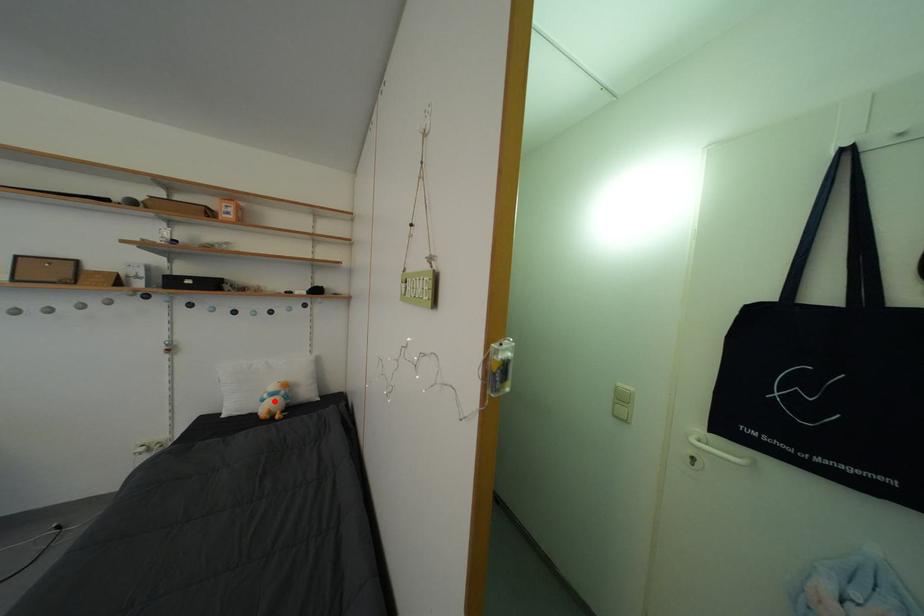
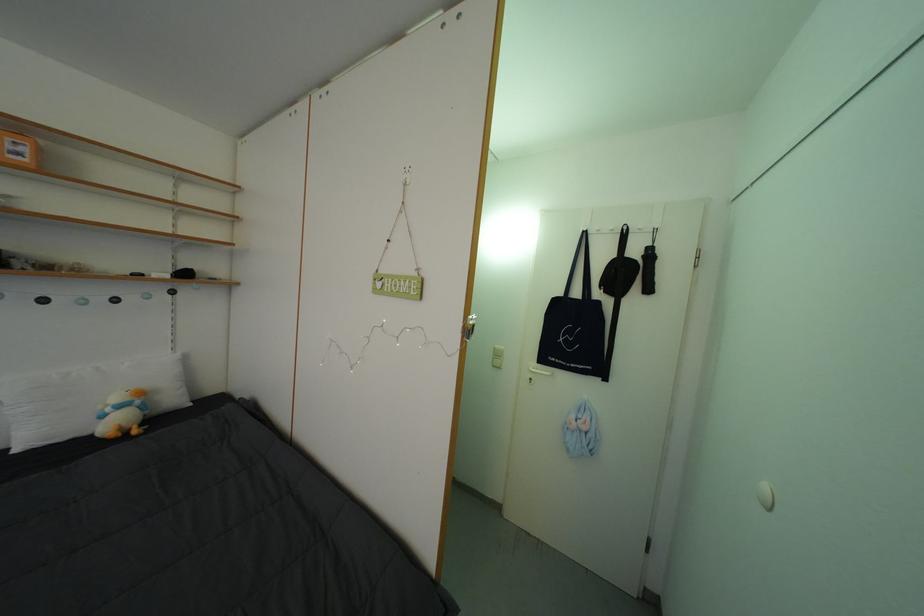
Question: I am providing you with two images of the same scene from different viewpoints. Given a red point in image1, look at the same physical point in image2. Is it:

Choices:
 (A) Closer to the viewpoint
 (B) Farther from the viewpoint

Answer: (A)